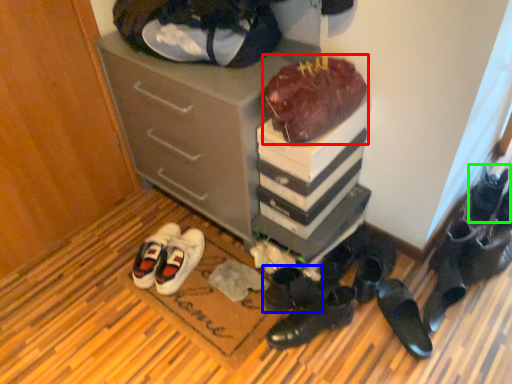
Question: Considering the real-world distances, which object is closest to chocolate cake (highlighted by a red box)? footwear (highlighted by a blue box) or footwear (highlighted by a green box).

Choices:
 (A) footwear
 (B) footwear

Answer: (A)